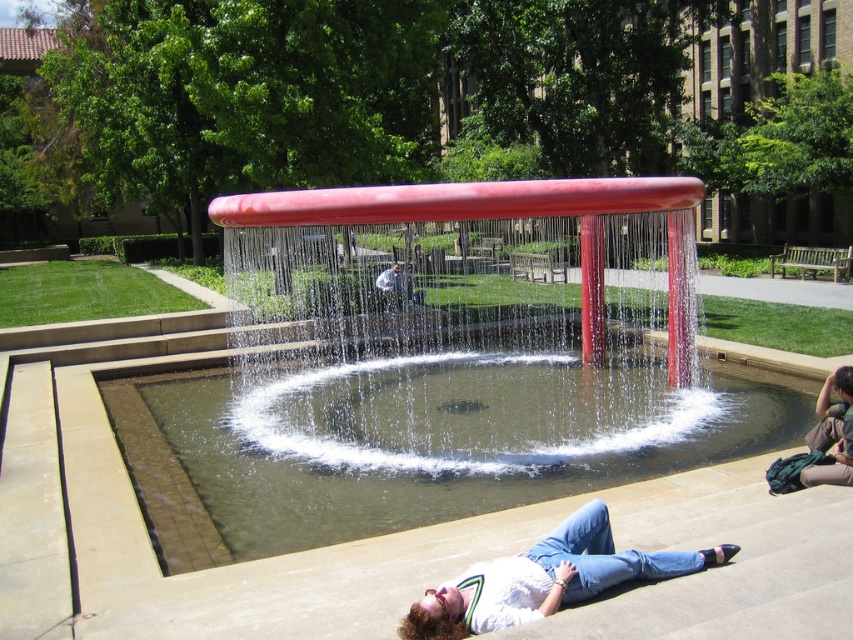
What do you see at coordinates (544, 579) in the screenshot? I see `white matte shirt at lower center` at bounding box center [544, 579].

Who is lower down, white matte shirt at lower center or smooth white shirt at center?

white matte shirt at lower center is lower down.

In order to click on white matte shirt at lower center in this screenshot , I will do `click(544, 579)`.

Is point (305, 204) less distant than point (399, 269)?

Yes.

Identify the location of smooth red water feature at center. (439, 364).

Is smooth red water feature at center shorter than denim jeans at lower right?

No, smooth red water feature at center is not shorter than denim jeans at lower right.

The image size is (853, 640). What do you see at coordinates (439, 364) in the screenshot? I see `smooth red water feature at center` at bounding box center [439, 364].

Which is in front, point (236, 472) or point (843, 419)?

Point (843, 419) is more forward.

Where is `smooth red water feature at center`? smooth red water feature at center is located at coordinates (439, 364).